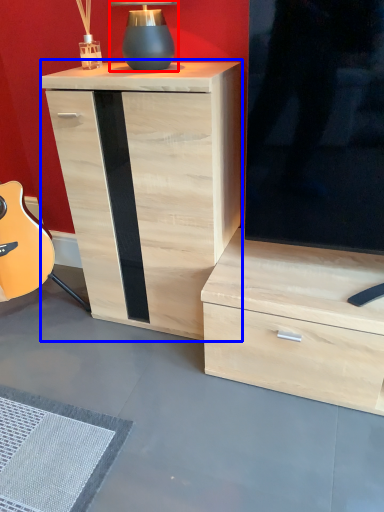
Question: Among these objects, which one is farthest to the camera, table lamp (highlighted by a red box) or chest of drawers (highlighted by a blue box)?

Choices:
 (A) table lamp
 (B) chest of drawers

Answer: (A)